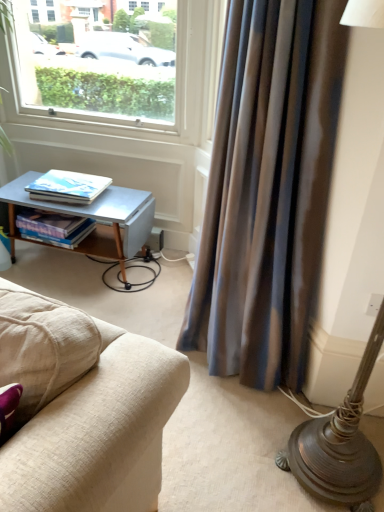
Question: Is hardcover books at lower left, which appears as the 1th book when ordered from the bottom, taller or shorter than silky blue curtain at right?

Choices:
 (A) tall
 (B) short

Answer: (B)

Question: Is hardcover books at lower left, which is counted as the second book, starting from the top, situated inside silky blue curtain at right or outside?

Choices:
 (A) outside
 (B) inside

Answer: (A)

Question: Which is nearer to the hardcover books at lower left, which appears as the 1th book when ordered from the bottom?

Choices:
 (A) white plastic window at upper left
 (B) matte white book at left, which appears as the 1th book when viewed from the top
 (C) silky blue curtain at right
 (D) metallic gray table at lower left

Answer: (D)

Question: Which is nearer to the matte white book at left, which appears as the 1th book when viewed from the top?

Choices:
 (A) white plastic window at upper left
 (B) hardcover books at lower left, which is counted as the second book, starting from the top
 (C) silky blue curtain at right
 (D) metallic gray table at lower left

Answer: (D)